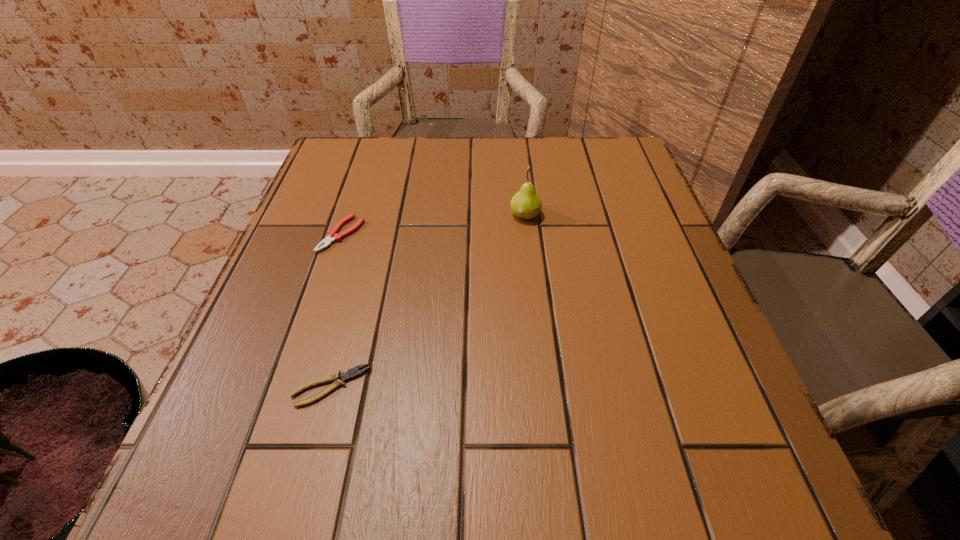
Where is `vacant space at the near edge of the desktop`? The width and height of the screenshot is (960, 540). vacant space at the near edge of the desktop is located at coordinates (638, 452).

In order to click on free space at the left edge of the desktop in this screenshot , I will do [280, 297].

I want to click on vacant space at the right edge of the desktop, so click(612, 260).

Locate an element on the screen. free space at the far left corner of the desktop is located at coordinates (322, 181).

At what (x,y) coordinates should I click in order to perform the action: click on vacant space at the far right corner of the desktop. Please return your answer as a coordinate pair (x, y). This screenshot has height=540, width=960. Looking at the image, I should click on (604, 151).

The image size is (960, 540). In order to click on vacant region between the second shortest object and the shortest object in this screenshot , I will do `click(336, 310)`.

Image resolution: width=960 pixels, height=540 pixels. I want to click on free point between the nearer pliers and the tallest object, so click(x=428, y=300).

Where is `vacant space that is in between the taller pliers and the tallest object`? Image resolution: width=960 pixels, height=540 pixels. vacant space that is in between the taller pliers and the tallest object is located at coordinates (433, 224).

Find the location of a particular element. Image resolution: width=960 pixels, height=540 pixels. free space between the second shortest object and the pear is located at coordinates (433, 224).

I want to click on blank region between the shortest object and the second tallest object, so click(336, 310).